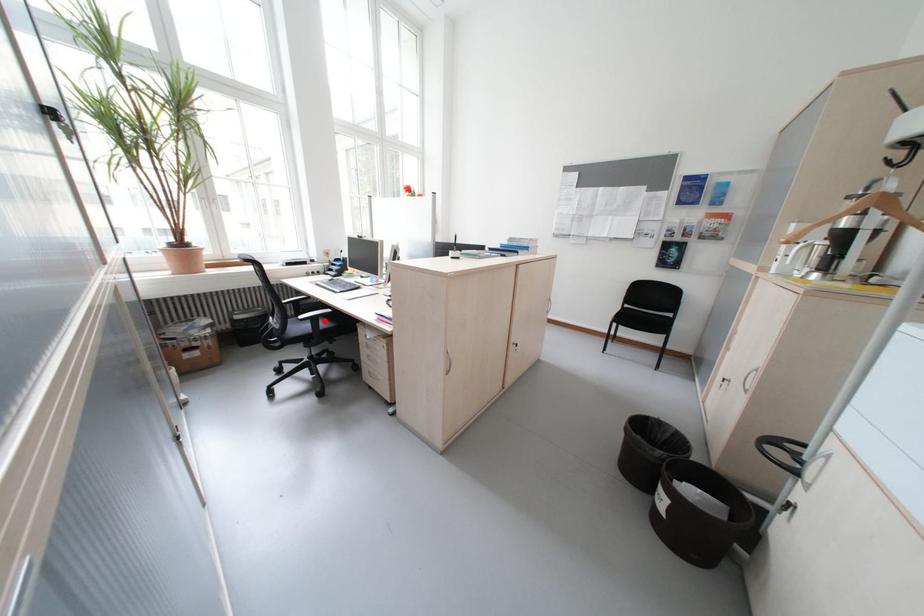
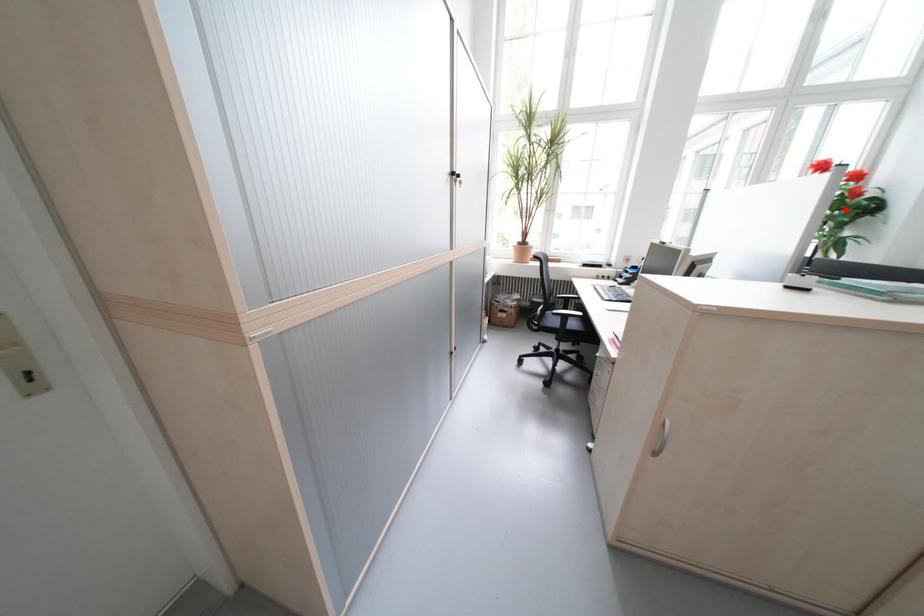
I am providing you with two images of the same scene from different viewpoints. A red point is marked on the first image and another point is marked on the second image. Do the highlighted points in image1 and image2 indicate the same real-world spot?

No